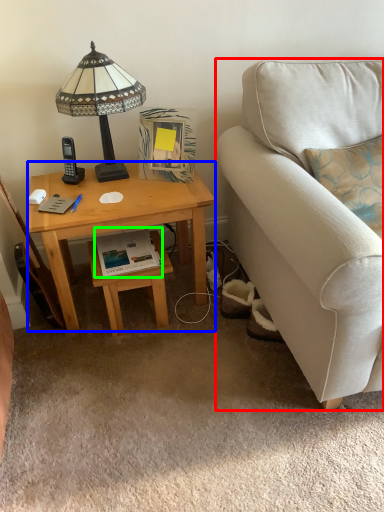
Question: Based on their relative distances, which object is nearer to studio couch (highlighted by a red box)? Choose from desk (highlighted by a blue box) and book (highlighted by a green box).

Choices:
 (A) desk
 (B) book

Answer: (A)